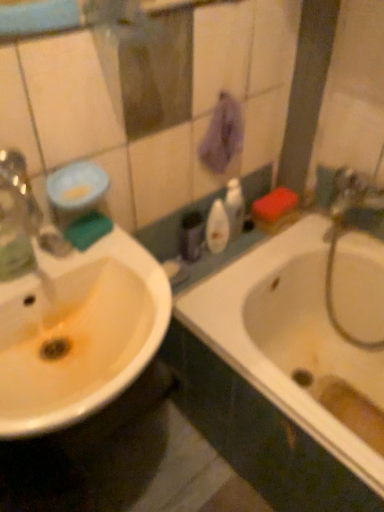
Question: Does white glossy sink at left have a lesser height compared to green sponge at left?

Choices:
 (A) no
 (B) yes

Answer: (A)

Question: Does white glossy sink at left turn towards green sponge at left?

Choices:
 (A) no
 (B) yes

Answer: (A)

Question: From a real-world perspective, is white glossy sink at left located higher than green sponge at left?

Choices:
 (A) no
 (B) yes

Answer: (A)

Question: Considering the relative positions of white glossy sink at left and green sponge at left in the image provided, is white glossy sink at left behind green sponge at left?

Choices:
 (A) no
 (B) yes

Answer: (A)

Question: Does white glossy sink at left appear on the right side of green sponge at left?

Choices:
 (A) yes
 (B) no

Answer: (B)

Question: Relative to purple fabric hand towel at upper center, is translucent plastic mouthwash at center, marked as the second mouthwash in a left-to-right arrangement, in front or behind?

Choices:
 (A) behind
 (B) front

Answer: (A)

Question: Is translucent plastic mouthwash at center, acting as the second mouthwash starting from the front, wider or thinner than purple fabric hand towel at upper center?

Choices:
 (A) thin
 (B) wide

Answer: (B)

Question: From the image's perspective, is translucent plastic mouthwash at center, marked as the second mouthwash in a left-to-right arrangement, positioned above or below purple fabric hand towel at upper center?

Choices:
 (A) below
 (B) above

Answer: (A)

Question: In terms of height, does translucent plastic mouthwash at center, marked as the 1th mouthwash in a right-to-left arrangement, look taller or shorter compared to purple fabric hand towel at upper center?

Choices:
 (A) tall
 (B) short

Answer: (B)

Question: Does point (218, 224) appear closer or farther from the camera than point (148, 287)?

Choices:
 (A) farther
 (B) closer

Answer: (A)

Question: From a real-world perspective, is translucent plastic mouthwash at center, which appears as the 1th mouthwash when viewed from the back, positioned above or below white glossy sink at left?

Choices:
 (A) below
 (B) above

Answer: (A)

Question: Is translucent plastic mouthwash at center, acting as the second mouthwash starting from the front, inside the boundaries of white glossy sink at left, or outside?

Choices:
 (A) outside
 (B) inside

Answer: (A)

Question: Is translucent plastic mouthwash at center, which appears as the 1th mouthwash when viewed from the back, wider or thinner than white glossy sink at left?

Choices:
 (A) thin
 (B) wide

Answer: (A)

Question: Is point (74, 357) closer or farther from the camera than point (94, 233)?

Choices:
 (A) farther
 (B) closer

Answer: (B)

Question: From a real-world perspective, is white glossy sink at left positioned above or below green sponge at left, placed as the first mouthwash when sorted from left to right?

Choices:
 (A) below
 (B) above

Answer: (A)